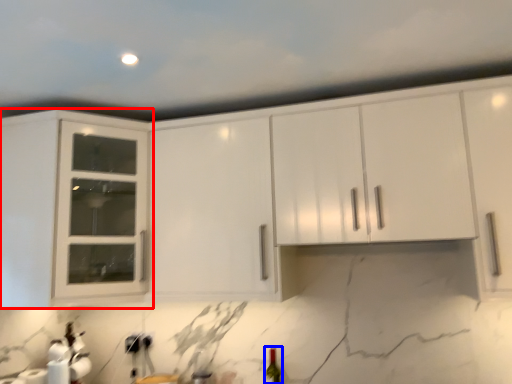
Question: Which point is closer to the camera, cabinetry (highlighted by a red box) or wine bottle (highlighted by a blue box)?

Choices:
 (A) cabinetry
 (B) wine bottle

Answer: (A)